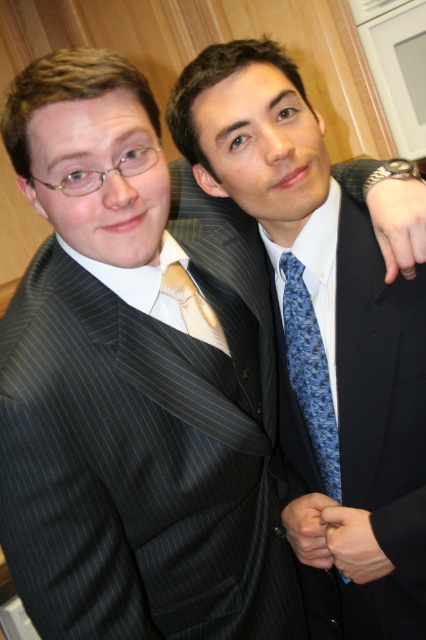
Consider the image. You are standing in the same room and want to locate the pinstriped suit at center. According to the coordinates provided, where should you look?

You should look at point (356, 417) to find the pinstriped suit at center.

You are a photographer adjusting the camera settings to ensure both the pinstriped suit at center and the satin gold tie at center are in focus. Considering their sizes, which one might require more careful adjustment to avoid blurring?

The satin gold tie at center is smaller than the pinstriped suit at center, so it might require more careful adjustment to avoid blurring since smaller objects can be harder to focus on precisely.

You are standing in the room and want to determine which point is closer to you. Can you tell me which one is closer between the point at coordinates (310,422) and the point at coordinates (207,342)?

Point at coordinates (310,422) is closer to you because it is further to the viewer than point at coordinates (207,342).